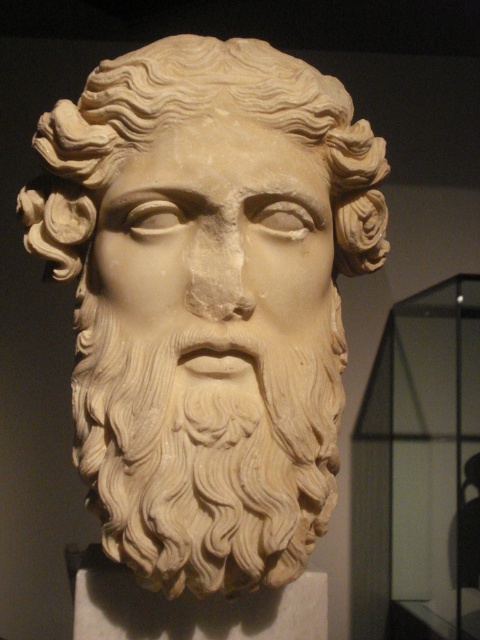
Who is taller, white stone beard at center or white marble face at center?

white stone beard at center is taller.

Who is shorter, white stone beard at center or white marble face at center?

white marble face at center is shorter.

Identify the location of white stone beard at center. (205, 452).

The height and width of the screenshot is (640, 480). What are the coordinates of `white stone beard at center` in the screenshot? It's located at (205, 452).

Is white marble head at center shorter than white stone beard at center?

No, white marble head at center is not shorter than white stone beard at center.

Does white marble head at center have a larger size compared to white stone beard at center?

Indeed, white marble head at center has a larger size compared to white stone beard at center.

Describe the element at coordinates (207, 300) in the screenshot. The height and width of the screenshot is (640, 480). I see `white marble head at center` at that location.

The image size is (480, 640). Find the location of `white marble head at center`. white marble head at center is located at coordinates (207, 300).

Between point (117, 64) and point (301, 220), which one is positioned in front?

Point (301, 220)

Measure the distance between white marble head at center and camera.

1.51 meters

Where is `white marble head at center`? This screenshot has width=480, height=640. white marble head at center is located at coordinates (207, 300).